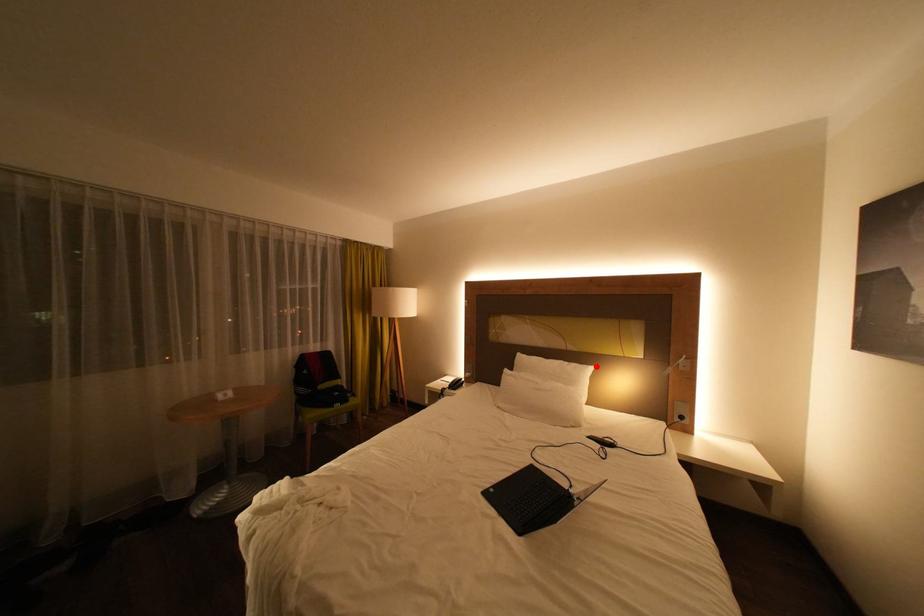
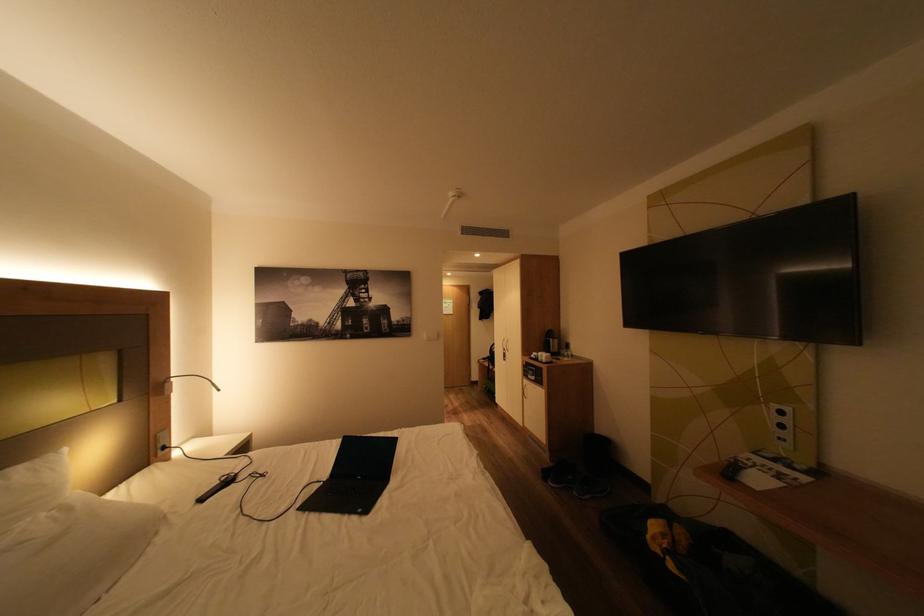
Where in the second image is the point corresponding to the highlighted location from the first image?

(62, 455)